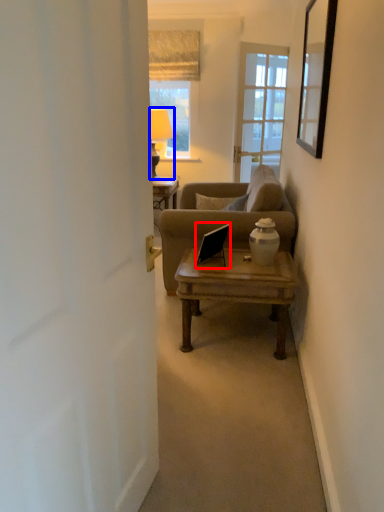
Question: Which of the following is the closest to the observer, laptop (highlighted by a red box) or lamp (highlighted by a blue box)?

Choices:
 (A) laptop
 (B) lamp

Answer: (A)